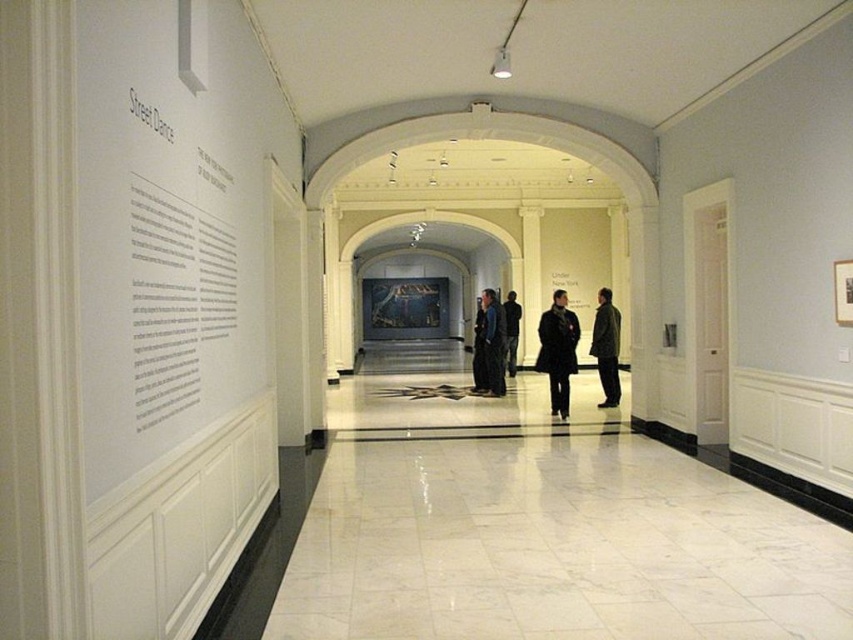
Question: Is dark brown leather coat at center positioned in front of dark brown leather jacket at center?

Choices:
 (A) no
 (B) yes

Answer: (B)

Question: Estimate the real-world distances between objects in this image. Which object is farther from the dark brown leather jacket at center?

Choices:
 (A) dark blue coat at center
 (B) dark blue jacket at center
 (C) dark brown leather coat at center

Answer: (A)

Question: Considering the real-world distances, which object is closest to the dark blue jacket at center?

Choices:
 (A) dark brown leather coat at center
 (B) dark brown leather jacket at center

Answer: (B)

Question: Does dark blue jacket at center appear under dark brown leather jacket at center?

Choices:
 (A) no
 (B) yes

Answer: (A)

Question: Which point appears farthest from the camera in this image?

Choices:
 (A) (567, 314)
 (B) (608, 333)
 (C) (492, 392)
 (D) (506, 356)

Answer: (D)

Question: Is dark brown leather coat at center above dark blue coat at center?

Choices:
 (A) yes
 (B) no

Answer: (A)